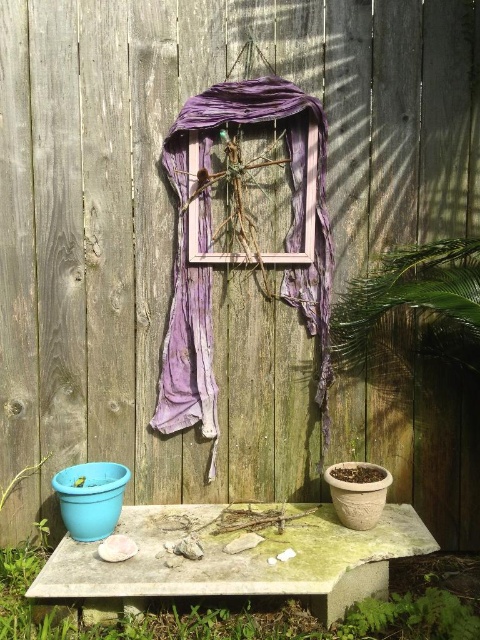
Question: Can you confirm if purple fabric at center is smaller than wooden frame at center?

Choices:
 (A) yes
 (B) no

Answer: (B)

Question: Is green mossy concrete at center below purple fabric at center?

Choices:
 (A) no
 (B) yes

Answer: (B)

Question: Which point is closer to the camera?

Choices:
 (A) green mossy concrete at center
 (B) purple fabric at center
 (C) wooden frame at center

Answer: (A)

Question: Which of the following is the closest to the observer?

Choices:
 (A) purple fabric at center
 (B) wooden frame at center
 (C) green mossy concrete at center

Answer: (C)

Question: Which point appears closest to the camera in this image?

Choices:
 (A) (190, 177)
 (B) (363, 538)

Answer: (B)

Question: Observing the image, what is the correct spatial positioning of green mossy concrete at center in reference to wooden frame at center?

Choices:
 (A) below
 (B) above

Answer: (A)